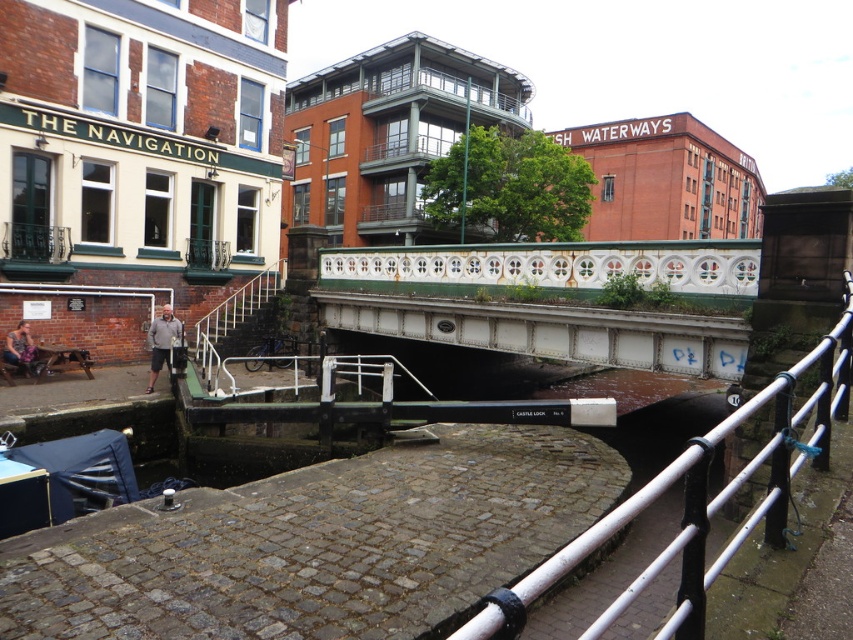
Question: Does gray fabric pants at lower left have a lesser width compared to matte black jacket at lower left?

Choices:
 (A) yes
 (B) no

Answer: (B)

Question: Which object appears farthest from the camera in this image?

Choices:
 (A) matte black jacket at lower left
 (B) gray fabric pants at lower left

Answer: (A)

Question: Does white painted metal bridge at center appear on the right side of matte black jacket at lower left?

Choices:
 (A) yes
 (B) no

Answer: (A)

Question: Does white metal railing at center appear on the right side of gray fabric pants at lower left?

Choices:
 (A) no
 (B) yes

Answer: (B)

Question: Which point is farther to the camera?

Choices:
 (A) (35, 371)
 (B) (166, 310)
 (C) (550, 312)

Answer: (A)

Question: Based on their relative distances, which object is nearer to the matte black jacket at lower left?

Choices:
 (A) gray fabric pants at lower left
 (B) white painted metal bridge at center

Answer: (A)